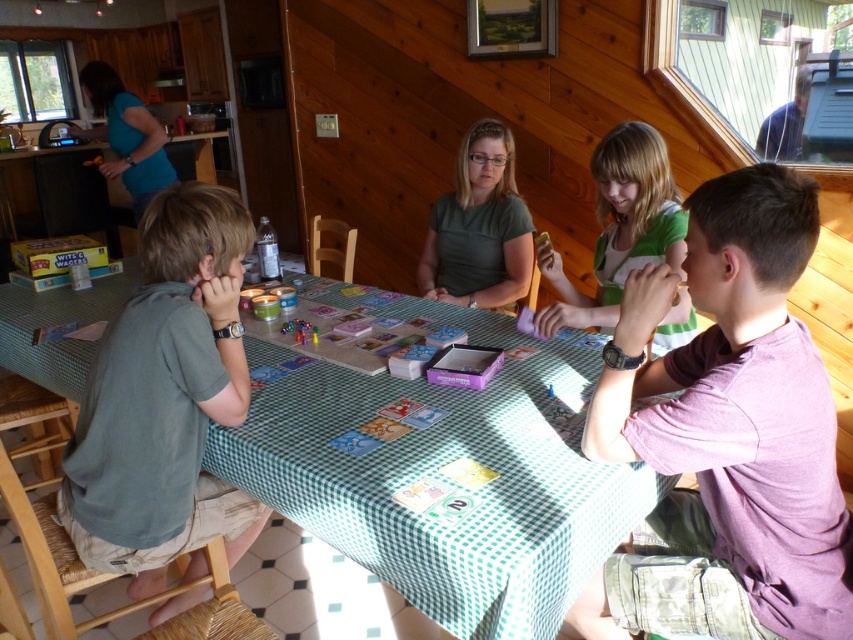
Can you confirm if green cotton shirt at left is taller than green matte shirt at center?

Yes, green cotton shirt at left is taller than green matte shirt at center.

Who is positioned more to the left, green cotton shirt at left or green matte shirt at center?

green cotton shirt at left

Where is `green cotton shirt at left`? The height and width of the screenshot is (640, 853). green cotton shirt at left is located at coordinates (165, 401).

Can you confirm if green checkered tablecloth at center is positioned below blue fabric shirt at upper left?

Correct, green checkered tablecloth at center is located below blue fabric shirt at upper left.

Which is behind, point (361, 465) or point (132, 150)?

The point (132, 150) is more distant.

Locate an element on the screen. The height and width of the screenshot is (640, 853). green checkered tablecloth at center is located at coordinates (440, 472).

Can you confirm if green cotton shirt at left is positioned to the left of green jersey at center?

Yes, green cotton shirt at left is to the left of green jersey at center.

Is point (236, 236) closer to viewer compared to point (645, 145)?

Yes, point (236, 236) is in front of point (645, 145).

Find the location of `green cotton shirt at left`. green cotton shirt at left is located at coordinates (165, 401).